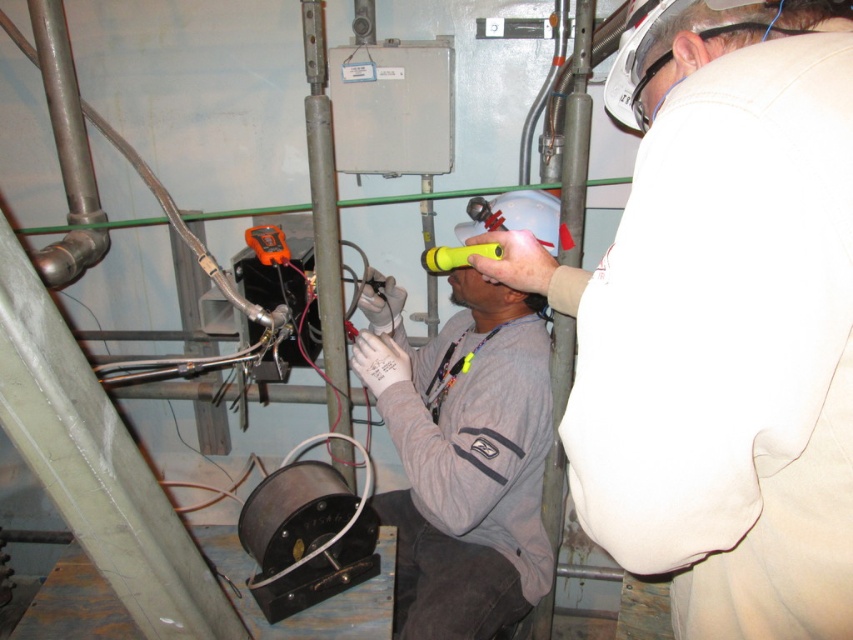
Question: From the image, what is the correct spatial relationship of white matte helmet at upper center in relation to gray matte shirt at center?

Choices:
 (A) right
 (B) left

Answer: (A)

Question: Among these points, which one is nearest to the camera?

Choices:
 (A) (735, 225)
 (B) (451, 618)

Answer: (A)

Question: Can you confirm if white matte helmet at upper center is wider than gray matte shirt at center?

Choices:
 (A) no
 (B) yes

Answer: (A)

Question: Does white matte helmet at upper center appear on the left side of gray matte shirt at center?

Choices:
 (A) yes
 (B) no

Answer: (B)